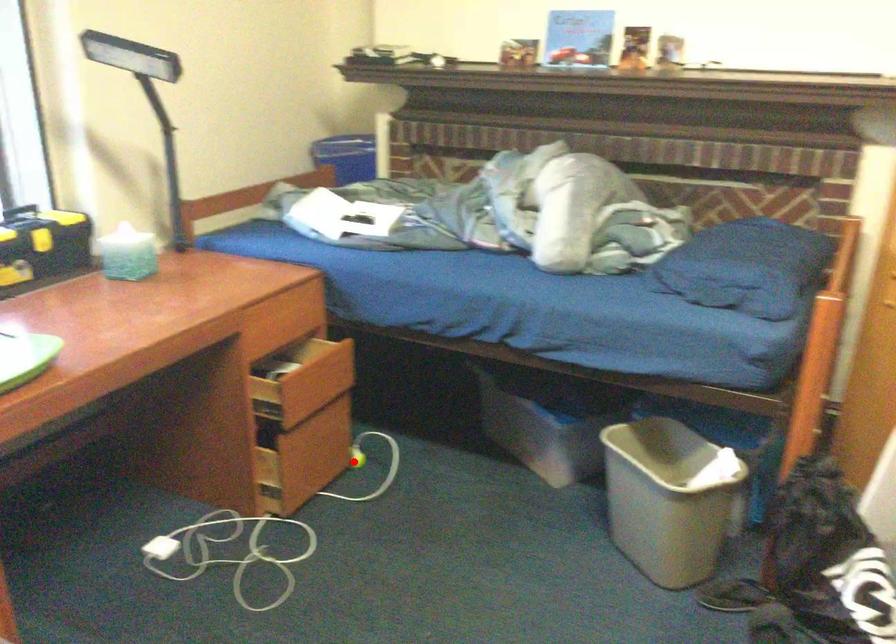
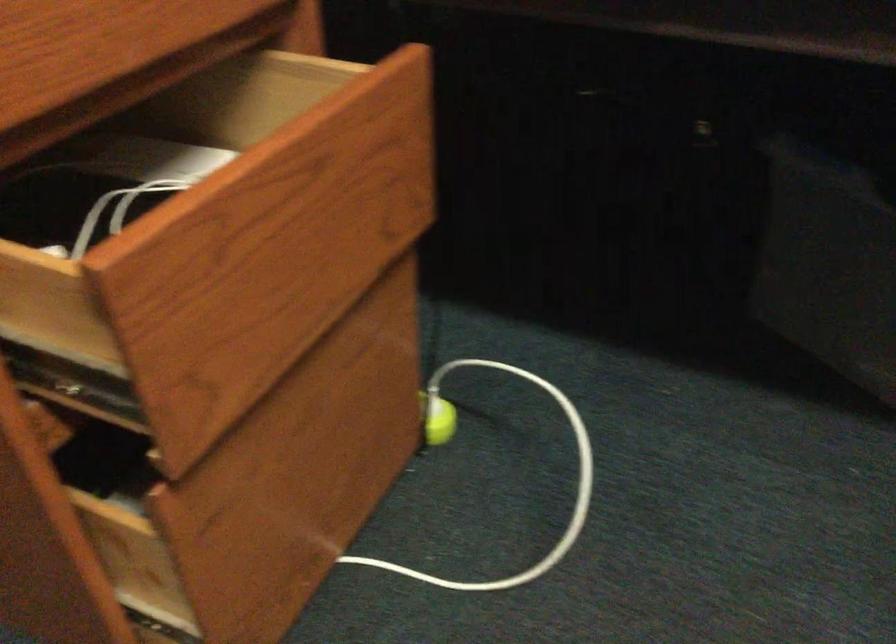
Question: I am providing you with two images of the same scene from different viewpoints. Image1 has a red point marked. In image2, the corresponding 3D location appears at what relative position? Reply with the corresponding letter.

Choices:
 (A) Closer
 (B) Farther

Answer: (A)